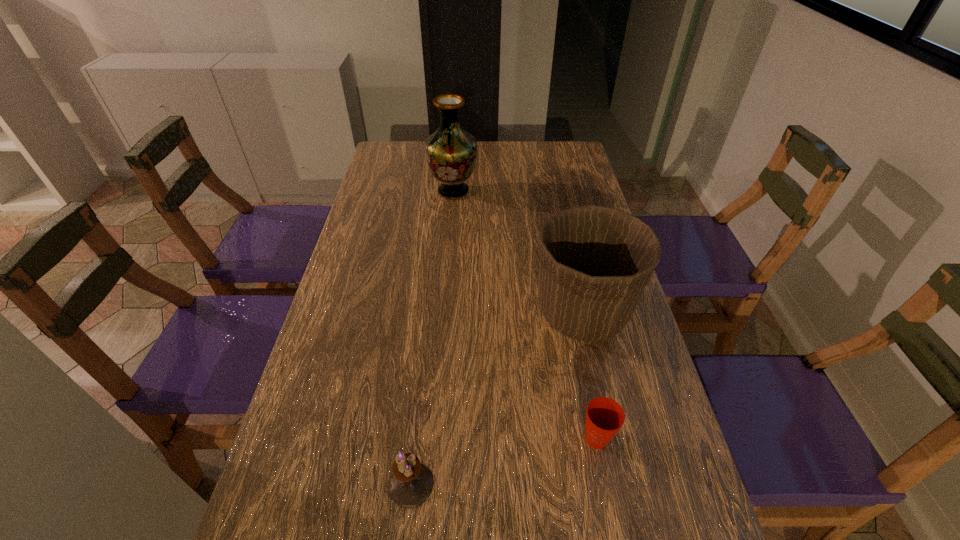
Find the location of a particular element. The image size is (960, 540). free space between the candle holder and the flowerpot is located at coordinates (496, 399).

The image size is (960, 540). I want to click on vacant area between the second shortest object and the farthest object, so click(x=432, y=338).

The height and width of the screenshot is (540, 960). In order to click on free space between the candle holder and the farthest object in this screenshot , I will do `click(432, 338)`.

Image resolution: width=960 pixels, height=540 pixels. I want to click on free spot between the second shortest object and the second farthest object, so click(x=496, y=399).

At what (x,y) coordinates should I click in order to perform the action: click on free space between the vase and the third farthest object. Please return your answer as a coordinate pair (x, y). This screenshot has width=960, height=540. Looking at the image, I should click on (525, 315).

The height and width of the screenshot is (540, 960). Identify the location of vacant area that lies between the third tallest object and the cup. (504, 462).

I want to click on vacant area that lies between the flowerpot and the second nearest object, so click(589, 376).

Locate which object ranks second in proximity to the farthest object. Please provide its 2D coordinates. Your answer should be formatted as a tuple, i.e. [(x, y)], where the tuple contains the x and y coordinates of a point satisfying the conditions above.

[(604, 417)]

This screenshot has height=540, width=960. Find the location of `the third closest object to the shortest object`. the third closest object to the shortest object is located at coordinates (451, 152).

This screenshot has height=540, width=960. Find the location of `free space in the image that satisfies the following two spatial constraints: 1. on the back side of the nearest object; 2. on the left side of the third nearest object`. free space in the image that satisfies the following two spatial constraints: 1. on the back side of the nearest object; 2. on the left side of the third nearest object is located at coordinates (429, 314).